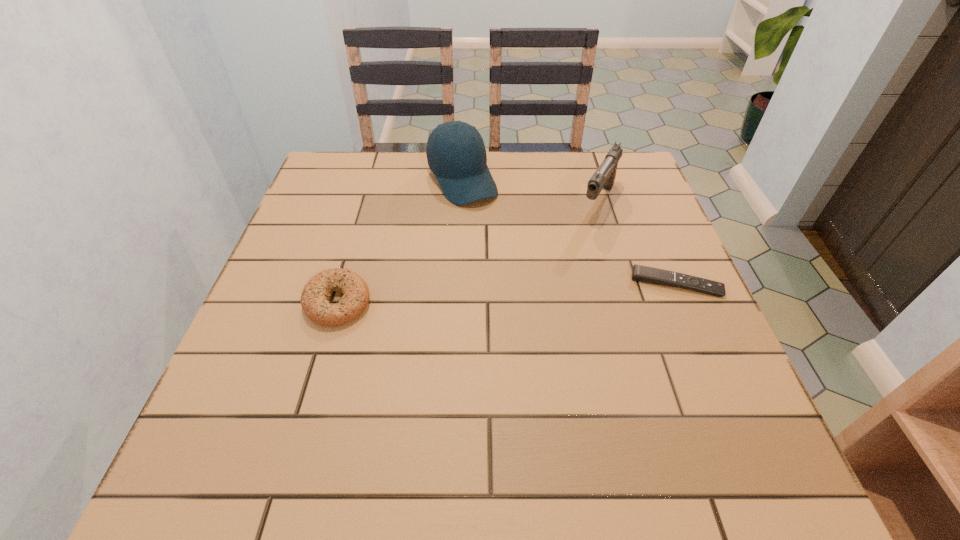
Where is `free point located 0.380m on the front-facing side of the baseball cap`? Image resolution: width=960 pixels, height=540 pixels. free point located 0.380m on the front-facing side of the baseball cap is located at coordinates (546, 307).

Locate an element on the screen. free region located on the front-facing side of the baseball cap is located at coordinates (511, 255).

I want to click on free space located on the front-facing side of the baseball cap, so click(511, 255).

The width and height of the screenshot is (960, 540). I want to click on gun present at the far edge, so click(603, 178).

Where is `baseball cap located in the far edge section of the desktop`? baseball cap located in the far edge section of the desktop is located at coordinates (456, 154).

Locate an element on the screen. object that is positioned at the left edge is located at coordinates (315, 297).

Image resolution: width=960 pixels, height=540 pixels. Find the location of `remote control present at the right edge`. remote control present at the right edge is located at coordinates (640, 273).

Locate an element on the screen. The height and width of the screenshot is (540, 960). gun at the right edge is located at coordinates (603, 178).

Identify the location of object that is at the far right corner. This screenshot has height=540, width=960. (603, 178).

In order to click on blank space at the far edge in this screenshot , I will do `click(409, 185)`.